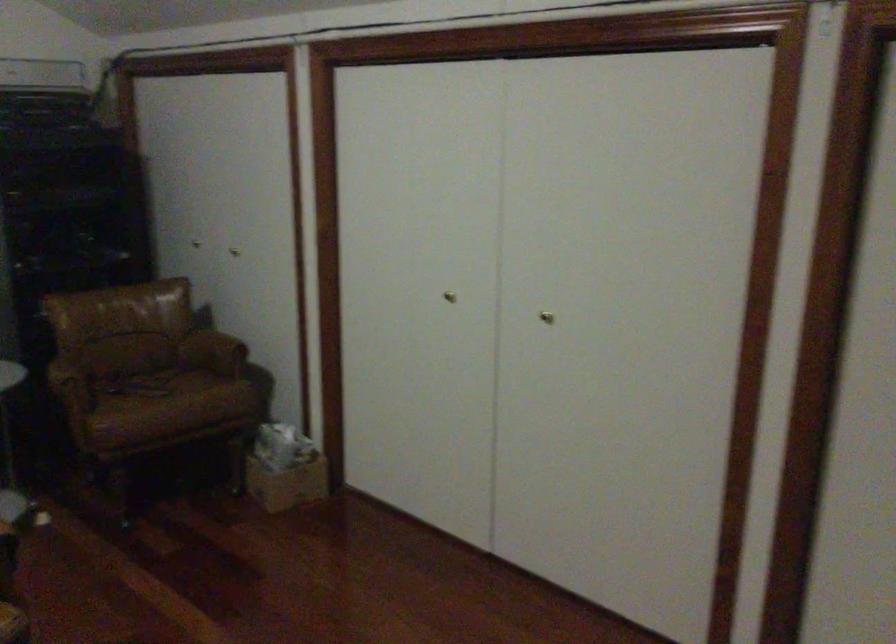
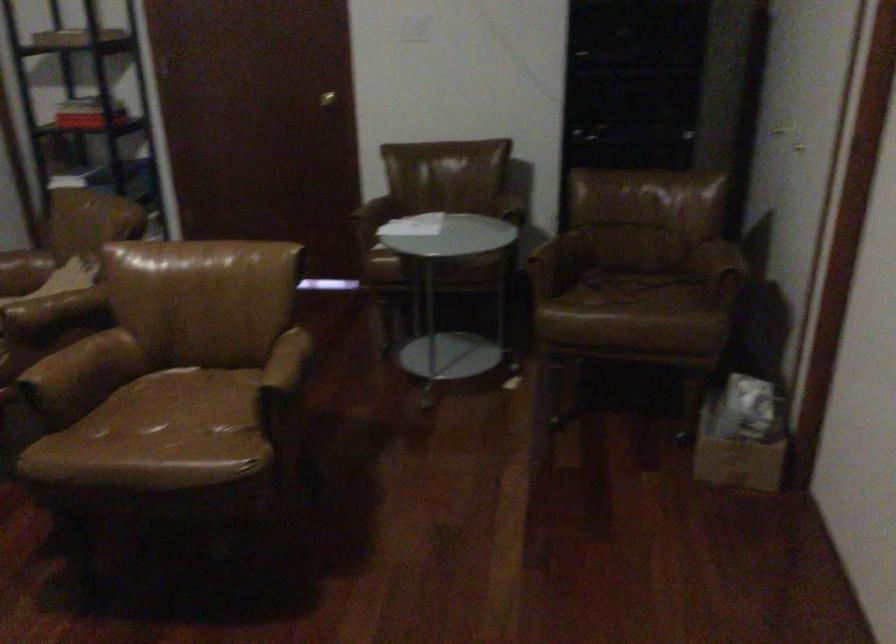
The point at [297,464] is marked in the first image. Where is the corresponding point in the second image?

(742, 436)